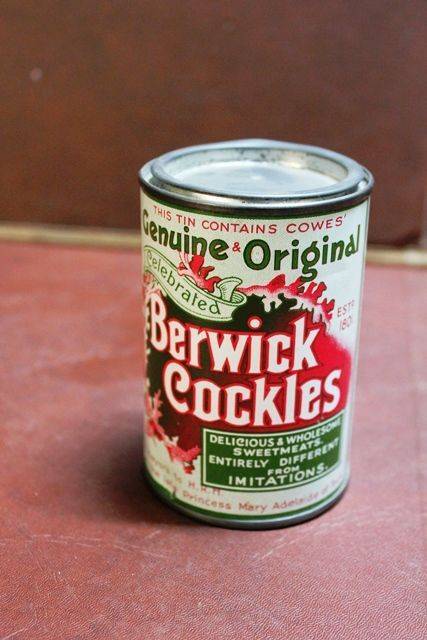
You are a GUI agent. You are given a task and a screenshot of the screen. Output one action in this format:
    pyautogui.click(x=<x>, y=<y>)
    Task: Click on the floor
    The width and height of the screenshot is (427, 640).
    Given the screenshot: What is the action you would take?
    pyautogui.click(x=366, y=593)